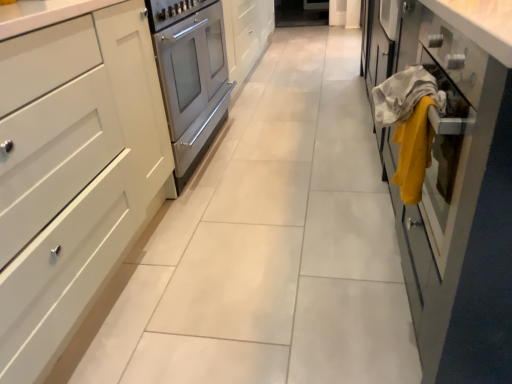
Question: Is matte glass cabinet at right, placed as the 1th cabinetry when sorted from right to left, looking in the opposite direction of yellow fabric at right, positioned as the 2th blanket in right-to-left order?

Choices:
 (A) yes
 (B) no

Answer: (A)

Question: Is the position of matte glass cabinet at right, the second cabinetry when ordered from left to right, more distant than that of yellow fabric at right, positioned as the 2th blanket in right-to-left order?

Choices:
 (A) yes
 (B) no

Answer: (B)

Question: Does matte glass cabinet at right, placed as the 1th cabinetry when sorted from right to left, turn towards yellow fabric at right, positioned as the 2th blanket in right-to-left order?

Choices:
 (A) yes
 (B) no

Answer: (A)

Question: Can you confirm if matte glass cabinet at right, placed as the 1th cabinetry when sorted from right to left, is bigger than yellow fabric at right, marked as the 1th blanket in a left-to-right arrangement?

Choices:
 (A) no
 (B) yes

Answer: (B)

Question: Can you confirm if matte glass cabinet at right, the second cabinetry when ordered from left to right, is taller than yellow fabric at right, positioned as the 2th blanket in right-to-left order?

Choices:
 (A) yes
 (B) no

Answer: (A)

Question: Is matte glass cabinet at right, placed as the 1th cabinetry when sorted from right to left, to the left of yellow fabric at right, positioned as the 2th blanket in right-to-left order, from the viewer's perspective?

Choices:
 (A) yes
 (B) no

Answer: (B)

Question: From a real-world perspective, does matte glass cabinet at right, the second cabinetry when ordered from left to right, sit lower than white matte cabinet at left, marked as the 1th cabinetry in a left-to-right arrangement?

Choices:
 (A) yes
 (B) no

Answer: (B)

Question: Is matte glass cabinet at right, the second cabinetry when ordered from left to right, positioned before white matte cabinet at left, which is the second cabinetry from right to left?

Choices:
 (A) yes
 (B) no

Answer: (A)

Question: Is matte glass cabinet at right, the second cabinetry when ordered from left to right, outside white matte cabinet at left, marked as the 1th cabinetry in a left-to-right arrangement?

Choices:
 (A) yes
 (B) no

Answer: (A)

Question: Is matte glass cabinet at right, the second cabinetry when ordered from left to right, turned away from white matte cabinet at left, marked as the 1th cabinetry in a left-to-right arrangement?

Choices:
 (A) yes
 (B) no

Answer: (B)

Question: Can you confirm if matte glass cabinet at right, placed as the 1th cabinetry when sorted from right to left, is taller than white matte cabinet at left, which is the second cabinetry from right to left?

Choices:
 (A) no
 (B) yes

Answer: (A)

Question: Can white matte cabinet at left, marked as the 1th cabinetry in a left-to-right arrangement, be found inside matte glass cabinet at right, the second cabinetry when ordered from left to right?

Choices:
 (A) yes
 (B) no

Answer: (B)

Question: Is the position of yellow fabric at right, positioned as the 2th blanket in right-to-left order, more distant than that of yellow fabric at right, the 1th blanket when ordered from right to left?

Choices:
 (A) no
 (B) yes

Answer: (A)